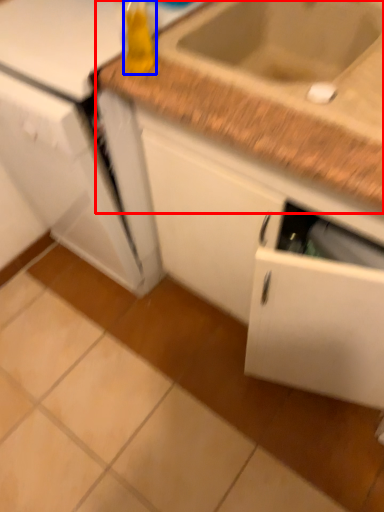
Question: Among these objects, which one is farthest to the camera, countertop (highlighted by a red box) or bottle (highlighted by a blue box)?

Choices:
 (A) countertop
 (B) bottle

Answer: (A)